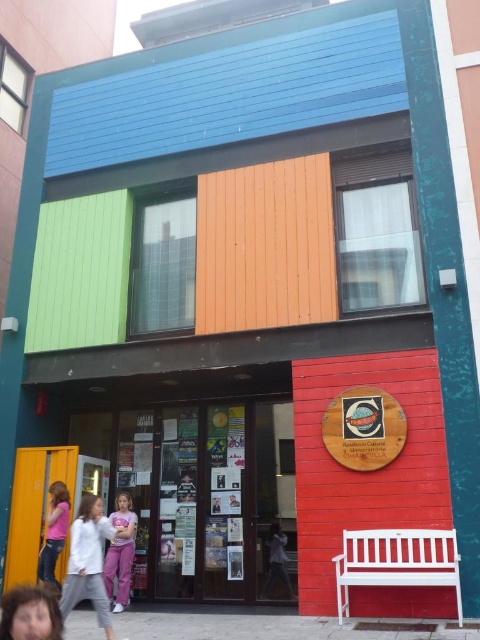
Is light purple pants at lower left shorter than pink fabric shirt at lower left?

No, light purple pants at lower left is not shorter than pink fabric shirt at lower left.

Which is in front, point (84, 593) or point (54, 483)?

Point (84, 593)

Is point (79, 561) positioned behind point (46, 573)?

No.

Find the location of a particular element. light purple pants at lower left is located at coordinates (88, 561).

Is point (46, 538) farther from camera compared to point (282, 532)?

No, (46, 538) is in front of (282, 532).

Can you confirm if pink fabric shirt at lower left is positioned to the left of light gray fabric shirt at center?

Correct, you'll find pink fabric shirt at lower left to the left of light gray fabric shirt at center.

You are a GUI agent. You are given a task and a screenshot of the screen. Output one action in this format:
    pyautogui.click(x=<x>, y=<y>)
    Task: Click on the pink fabric shirt at lower left
    
    Given the screenshot: What is the action you would take?
    pyautogui.click(x=54, y=532)

Can you confirm if light purple pants at lower left is positioned to the right of purple cotton pants at center?

Yes, light purple pants at lower left is to the right of purple cotton pants at center.

The height and width of the screenshot is (640, 480). Describe the element at coordinates (88, 561) in the screenshot. I see `light purple pants at lower left` at that location.

Find the location of a particular element. This screenshot has width=480, height=640. light purple pants at lower left is located at coordinates (88, 561).